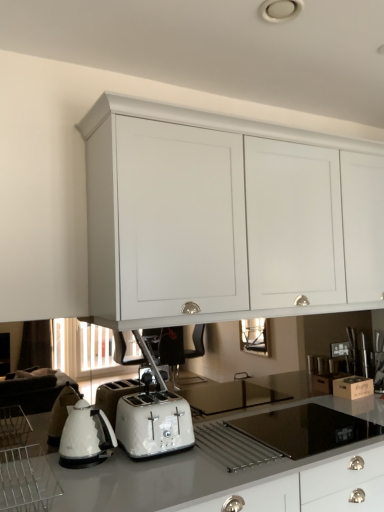
Question: Does black glass gas stove at center touch white glossy toaster at lower center?

Choices:
 (A) no
 (B) yes

Answer: (A)

Question: Is black glass gas stove at center thinner than white glossy toaster at lower center?

Choices:
 (A) yes
 (B) no

Answer: (B)

Question: Is black glass gas stove at center bigger than white glossy toaster at lower center?

Choices:
 (A) no
 (B) yes

Answer: (B)

Question: Considering the relative sizes of black glass gas stove at center and white glossy toaster at lower center in the image provided, is black glass gas stove at center smaller than white glossy toaster at lower center?

Choices:
 (A) no
 (B) yes

Answer: (A)

Question: Is black glass gas stove at center completely or partially outside of white glossy toaster at lower center?

Choices:
 (A) yes
 (B) no

Answer: (A)

Question: Is black glass gas stove at center to the left of white glossy toaster at lower center from the viewer's perspective?

Choices:
 (A) yes
 (B) no

Answer: (B)

Question: Does white glossy kettle at lower left have a larger size compared to white glossy countertop at lower center?

Choices:
 (A) yes
 (B) no

Answer: (B)

Question: From the image's perspective, is white glossy kettle at lower left above white glossy countertop at lower center?

Choices:
 (A) no
 (B) yes

Answer: (B)

Question: Is white glossy countertop at lower center at the back of white glossy kettle at lower left?

Choices:
 (A) yes
 (B) no

Answer: (B)

Question: From the image's perspective, is white glossy kettle at lower left below white glossy countertop at lower center?

Choices:
 (A) no
 (B) yes

Answer: (A)

Question: Is there a large distance between white glossy kettle at lower left and white glossy countertop at lower center?

Choices:
 (A) no
 (B) yes

Answer: (A)

Question: Can you confirm if white glossy kettle at lower left is wider than white glossy countertop at lower center?

Choices:
 (A) no
 (B) yes

Answer: (A)

Question: From the image's perspective, is white glossy kettle at lower left above white matte cabinet at upper center?

Choices:
 (A) yes
 (B) no

Answer: (B)